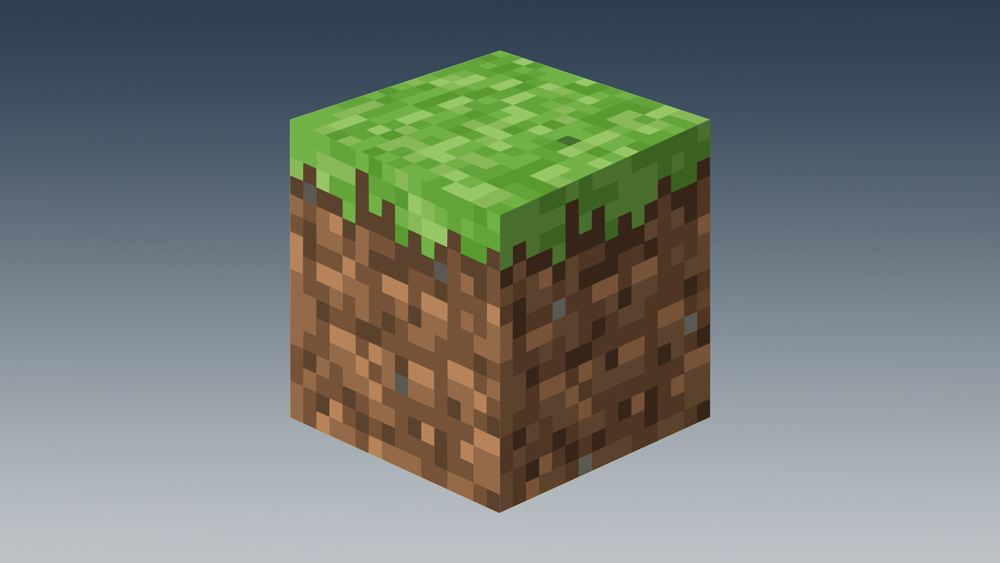
You are a GUI agent. You are given a task and a screenshot of the screen. Output one action in this format:
    pyautogui.click(x=<x>, y=<y>)
    Task: Click on the corners
    The height and width of the screenshot is (563, 1000).
    Given the screenshot: What is the action you would take?
    pyautogui.click(x=496, y=215), pyautogui.click(x=702, y=123), pyautogui.click(x=290, y=114), pyautogui.click(x=499, y=47)